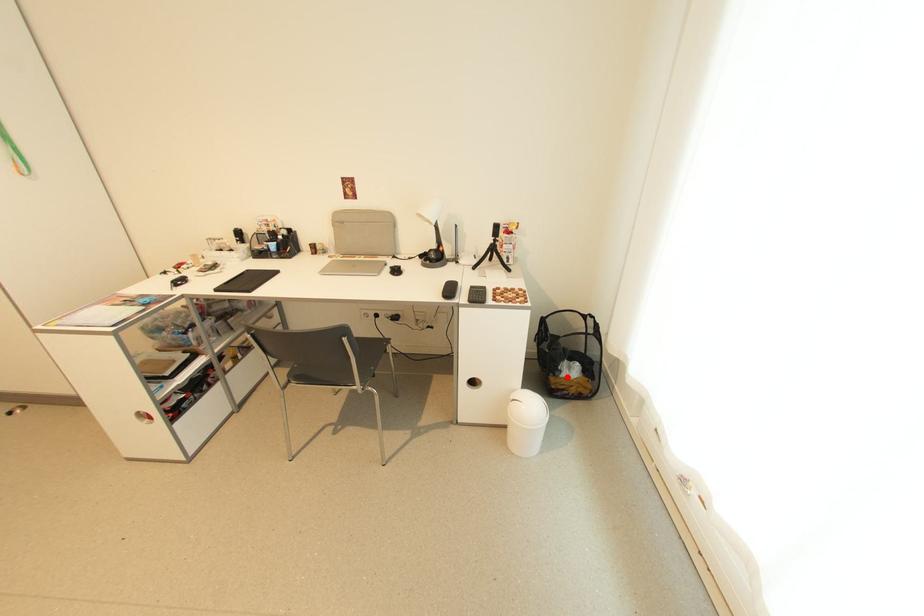
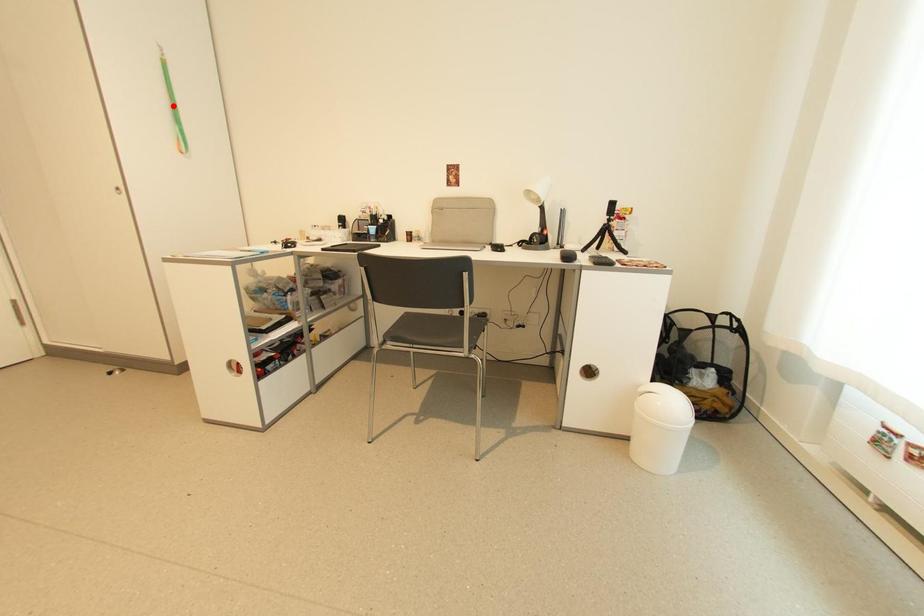
I am providing you with two images of the same scene from different viewpoints. A red point is marked on the first image and another point is marked on the second image. Do the highlighted points in image1 and image2 indicate the same real-world spot?

No